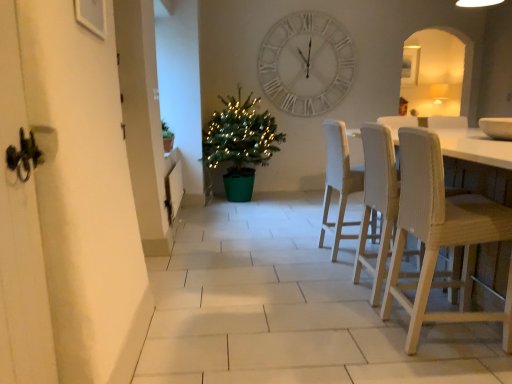
Question: From the image's perspective, is white woven chair at right, marked as the second chair in a front-to-back arrangement, positioned above or below white fabric chair at center, acting as the third chair starting from the front?

Choices:
 (A) below
 (B) above

Answer: (A)

Question: Would you say white woven chair at right, marked as the second chair in a front-to-back arrangement, is inside or outside white fabric chair at center, acting as the third chair starting from the front?

Choices:
 (A) inside
 (B) outside

Answer: (B)

Question: Estimate the real-world distances between objects in this image. Which object is farther from the white fabric chair at center, acting as the third chair starting from the front?

Choices:
 (A) white woven chair at right, marked as the second chair in a front-to-back arrangement
 (B) white matte wall clock at upper center
 (C) white woven chair at right, which is counted as the 3th chair, starting from the back
 (D) green plastic potted plant at center

Answer: (B)

Question: Which object is the closest to the white woven chair at right, which appears as the first chair when viewed from the front?

Choices:
 (A) white matte wall clock at upper center
 (B) white woven chair at right, marked as the second chair in a front-to-back arrangement
 (C) green plastic potted plant at center
 (D) white fabric chair at center, acting as the third chair starting from the front

Answer: (B)